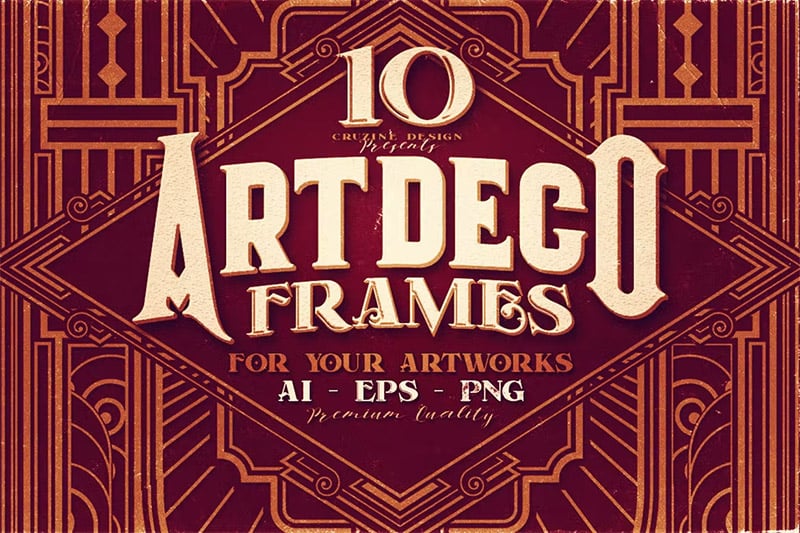
Where is `column`? The image size is (800, 533). column is located at coordinates (678, 104), (109, 95), (686, 161), (121, 174), (114, 48), (674, 41), (118, 118).